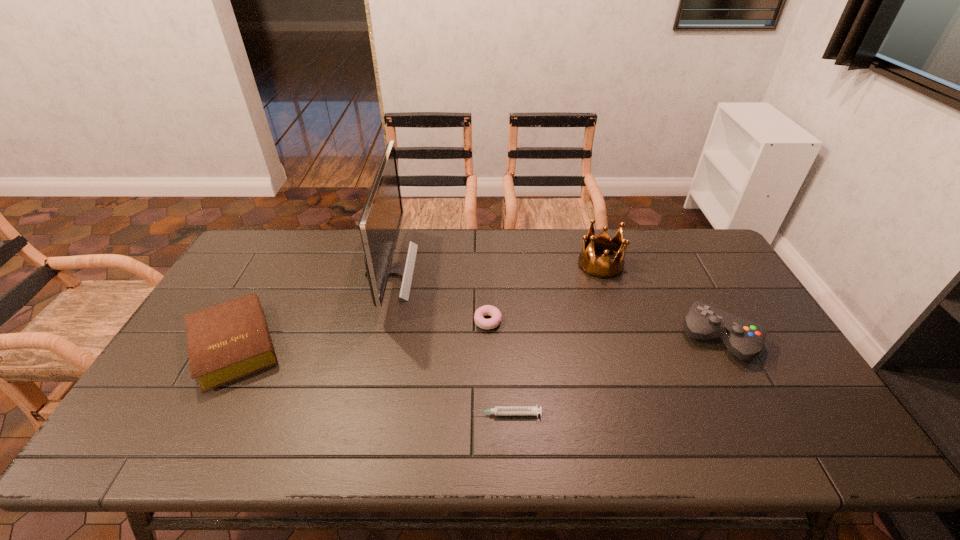
Image resolution: width=960 pixels, height=540 pixels. In order to click on monitor in this screenshot , I will do `click(380, 221)`.

At what (x,y) coordinates should I click in order to perform the action: click on the fifth object from right to left. Please return your answer as a coordinate pair (x, y). Looking at the image, I should click on [x=380, y=221].

The width and height of the screenshot is (960, 540). Identify the location of the fifth object from left to right. (603, 268).

Identify the location of crown. (603, 268).

This screenshot has height=540, width=960. Identify the location of control. (743, 338).

The width and height of the screenshot is (960, 540). Find the location of `the rightmost object`. the rightmost object is located at coordinates (743, 338).

At what (x,y) coordinates should I click in order to perform the action: click on the leftmost object. Please return your answer as a coordinate pair (x, y). This screenshot has width=960, height=540. Looking at the image, I should click on (228, 341).

This screenshot has width=960, height=540. What are the coordinates of `the fourth tallest object` in the screenshot? It's located at (228, 341).

Locate an element on the screen. the second shortest object is located at coordinates (487, 310).

The image size is (960, 540). I want to click on the shortest object, so click(498, 410).